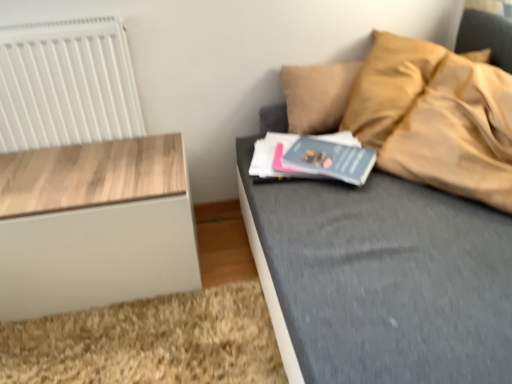
Measure the distance between point (21,121) and camera.

The depth of point (21,121) is 1.38 meters.

The image size is (512, 384). What do you see at coordinates (330, 159) in the screenshot?
I see `gray matte book at center` at bounding box center [330, 159].

I want to click on gray matte book at center, so click(x=330, y=159).

The height and width of the screenshot is (384, 512). Describe the element at coordinates (94, 225) in the screenshot. I see `wooden nightstand at left` at that location.

Where is `white plastic radiator at upper left`? The image size is (512, 384). white plastic radiator at upper left is located at coordinates (66, 84).

From the image's perspective, which is above, gray matte book at center or wooden nightstand at left?

gray matte book at center.

Considering the relative sizes of gray matte book at center and wooden nightstand at left in the image provided, is gray matte book at center thinner than wooden nightstand at left?

Yes.

Is gray matte book at center oriented towards wooden nightstand at left?

No, gray matte book at center is not facing towards wooden nightstand at left.

Find the location of a particular element. paperback book located behind the wooden nightstand at left is located at coordinates (330, 159).

Where is `paperback book behind the wooden nightstand at left`? Image resolution: width=512 pixels, height=384 pixels. paperback book behind the wooden nightstand at left is located at coordinates (330, 159).

From the image's perspective, is wooden nightstand at left above gray matte book at center?

No, from the image's perspective, wooden nightstand at left is not on top of gray matte book at center.

What's the angular difference between wooden nightstand at left and gray matte book at center's facing directions?

wooden nightstand at left and gray matte book at center are facing 36.1 degrees away from each other.

Considering the positions of point (51, 173) and point (326, 165), is point (51, 173) closer or farther from the camera than point (326, 165)?

Clearly, point (51, 173) is more distant from the camera than point (326, 165).

In the scene shown: Considering the sizes of white plastic radiator at upper left and gray matte book at center in the image, is white plastic radiator at upper left taller or shorter than gray matte book at center?

white plastic radiator at upper left is taller than gray matte book at center.

Is white plastic radiator at upper left next to gray matte book at center and touching it?

No, white plastic radiator at upper left is not next to gray matte book at center.

Does white plastic radiator at upper left have a smaller size compared to gray matte book at center?

No, white plastic radiator at upper left is not smaller than gray matte book at center.

Does white plastic radiator at upper left appear on the right side of gray matte book at center?

In fact, white plastic radiator at upper left is to the left of gray matte book at center.

Is wooden nightstand at left bigger than white plastic radiator at upper left?

Yes, wooden nightstand at left is bigger than white plastic radiator at upper left.

Can you confirm if wooden nightstand at left is positioned to the right of white plastic radiator at upper left?

Yes.

From the image's perspective, would you say wooden nightstand at left is shown under white plastic radiator at upper left?

Yes, from the image's perspective, wooden nightstand at left is below white plastic radiator at upper left.

Is white plastic radiator at upper left oriented away from wooden nightstand at left?

No.

How much distance is there between white plastic radiator at upper left and wooden nightstand at left?

white plastic radiator at upper left is 27.73 centimeters from wooden nightstand at left.

Looking at this image, do you think white plastic radiator at upper left is within wooden nightstand at left, or outside of it?

white plastic radiator at upper left exists outside the volume of wooden nightstand at left.

From a real-world perspective, does white plastic radiator at upper left sit lower than wooden nightstand at left?

Incorrect, from a real-world perspective, white plastic radiator at upper left is higher than wooden nightstand at left.

Considering the relative sizes of gray matte book at center and white plastic radiator at upper left in the image provided, is gray matte book at center smaller than white plastic radiator at upper left?

Yes.

Based on the photo, is gray matte book at center not inside white plastic radiator at upper left?

Absolutely, gray matte book at center is external to white plastic radiator at upper left.

Is point (320, 165) positioned before point (66, 93)?

Yes.

Locate an element on the screen. The width and height of the screenshot is (512, 384). nightstand located below the gray matte book at center (from the image's perspective) is located at coordinates (94, 225).

The height and width of the screenshot is (384, 512). Identify the location of nightstand on the left of the gray matte book at center. (94, 225).

In the scene shown: Estimate the real-world distances between objects in this image. Which object is closer to gray matte book at center, white plastic radiator at upper left or wooden nightstand at left?

Among the two, wooden nightstand at left is located nearer to gray matte book at center.

Considering their positions, is white plastic radiator at upper left positioned closer to wooden nightstand at left than gray matte book at center?

Among the two, white plastic radiator at upper left is located nearer to wooden nightstand at left.

Based on their spatial positions, is gray matte book at center or wooden nightstand at left further from white plastic radiator at upper left?

gray matte book at center lies further to white plastic radiator at upper left than the other object.

Based on their spatial positions, is wooden nightstand at left or white plastic radiator at upper left further from gray matte book at center?

The object further to gray matte book at center is white plastic radiator at upper left.

Based on their spatial positions, is gray matte book at center or white plastic radiator at upper left further from wooden nightstand at left?

Among the two, gray matte book at center is located further to wooden nightstand at left.

When comparing their distances from white plastic radiator at upper left, does wooden nightstand at left or gray matte book at center seem further?

gray matte book at center lies further to white plastic radiator at upper left than the other object.

Where is `nightstand between white plastic radiator at upper left and gray matte book at center`? Image resolution: width=512 pixels, height=384 pixels. nightstand between white plastic radiator at upper left and gray matte book at center is located at coordinates (94, 225).